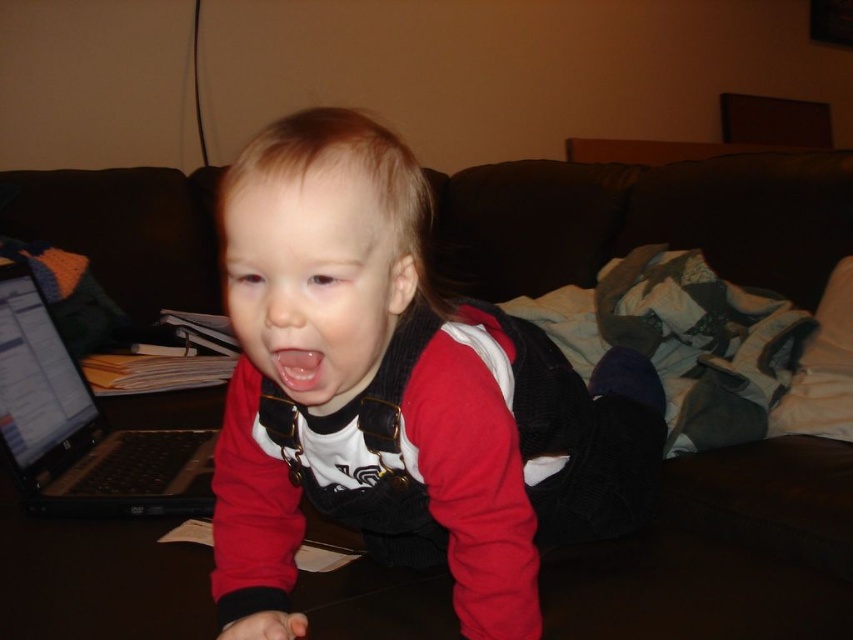
Question: Can you confirm if red matte vest at center is positioned to the left of black plastic laptop at left?

Choices:
 (A) yes
 (B) no

Answer: (B)

Question: Is the position of red matte vest at center more distant than that of clear pink flesh at center?

Choices:
 (A) yes
 (B) no

Answer: (B)

Question: Which point is farther to the camera?

Choices:
 (A) black plastic laptop at left
 (B) red matte vest at center
 (C) clear pink flesh at center

Answer: (A)

Question: Which object appears closest to the camera in this image?

Choices:
 (A) clear pink flesh at center
 (B) red matte vest at center
 (C) black plastic laptop at left

Answer: (B)

Question: Does red matte vest at center appear on the left side of clear pink flesh at center?

Choices:
 (A) yes
 (B) no

Answer: (B)

Question: Among these points, which one is farthest from the camera?

Choices:
 (A) (274, 364)
 (B) (239, 323)
 (C) (30, 502)

Answer: (C)